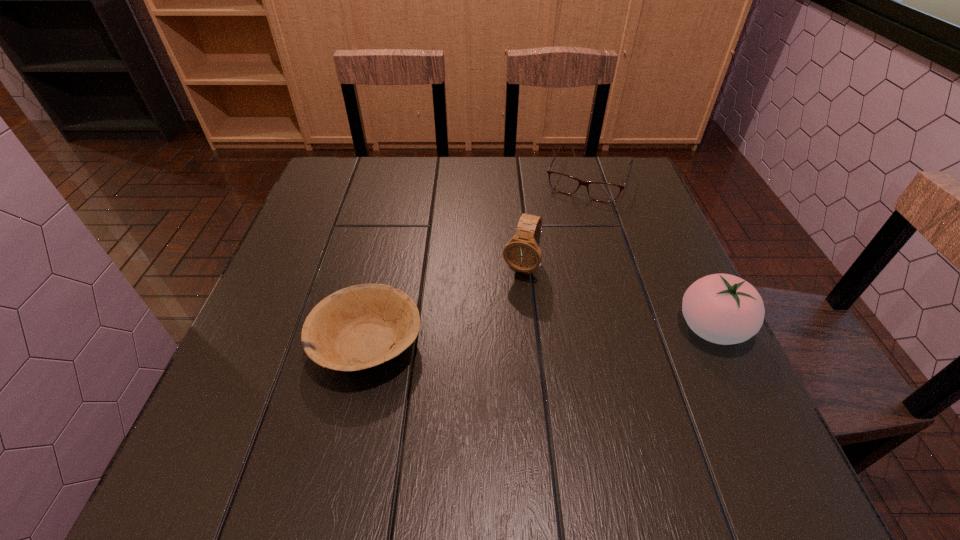
Where is `vacant space at the far edge of the desktop`? This screenshot has width=960, height=540. vacant space at the far edge of the desktop is located at coordinates (x=416, y=158).

This screenshot has width=960, height=540. I want to click on free space at the near edge, so click(x=394, y=385).

Where is `vacant space at the left edge of the desktop`? This screenshot has height=540, width=960. vacant space at the left edge of the desktop is located at coordinates (313, 224).

In order to click on vacant point at the right edge in this screenshot , I will do `click(638, 211)`.

Find the location of `free space at the far left corner of the desktop`. free space at the far left corner of the desktop is located at coordinates (338, 158).

Locate an element on the screen. Image resolution: width=960 pixels, height=540 pixels. vacant space at the near left corner of the desktop is located at coordinates (221, 394).

Where is `free space between the leftmost object and the third nearest object`? The image size is (960, 540). free space between the leftmost object and the third nearest object is located at coordinates (444, 306).

This screenshot has height=540, width=960. I want to click on free spot between the tomato and the watch, so click(616, 298).

Identify the location of free space between the tomato and the farthest object. This screenshot has height=540, width=960. (650, 253).

I want to click on free spot between the spectacles and the bowl, so click(478, 261).